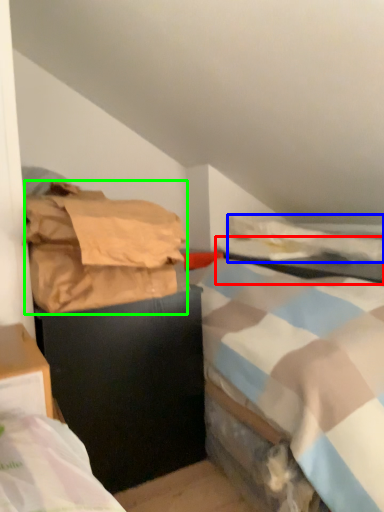
Question: Which is farther away from table (highlighted by a red box)? blanket (highlighted by a blue box) or material (highlighted by a green box)?

Choices:
 (A) blanket
 (B) material

Answer: (B)